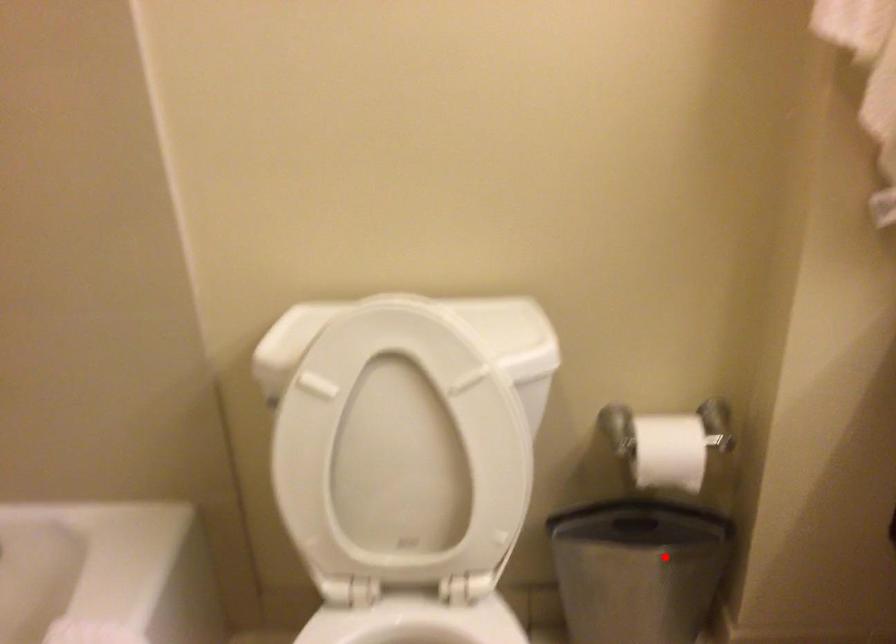
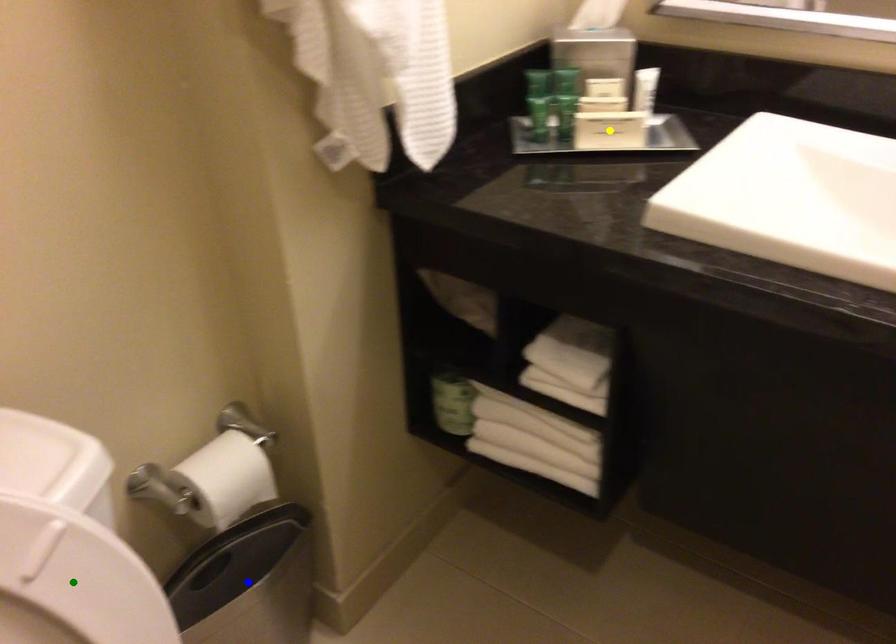
Question: I am providing you with two images of the same scene from different viewpoints. A red point is marked on the first image. You are given multiple points on the second image. Which point in image 2 represents the same 3d spot as the red point in image 1?

Choices:
 (A) yellow point
 (B) green point
 (C) blue point

Answer: (C)